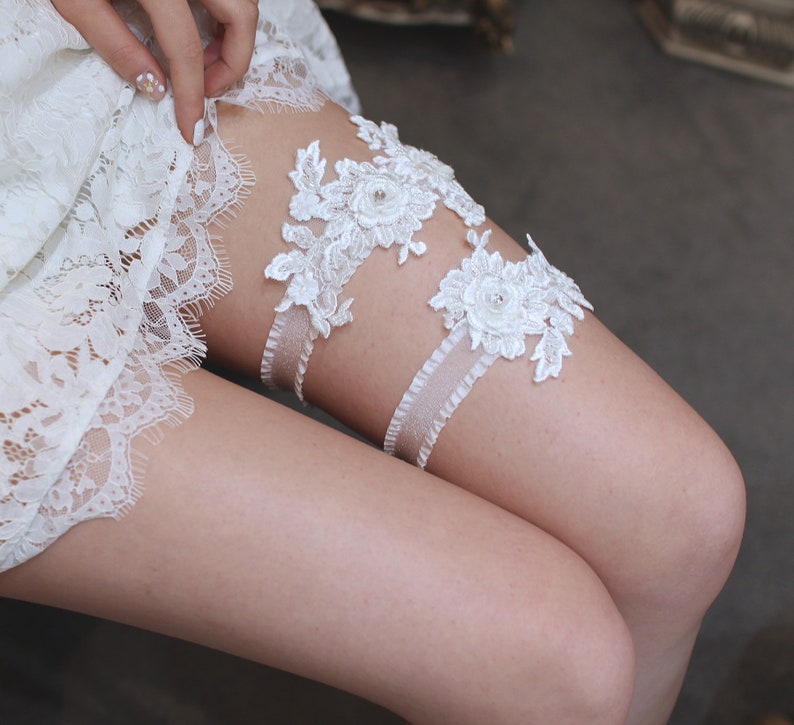
This screenshot has width=794, height=725. Identify the location of lace. (125, 404), (286, 69), (314, 172), (554, 286), (453, 293), (467, 207).